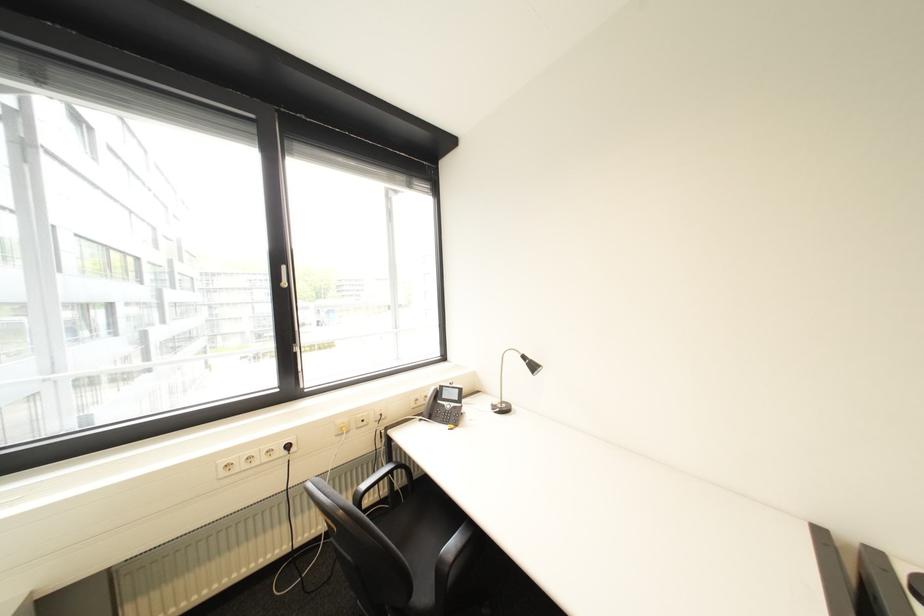
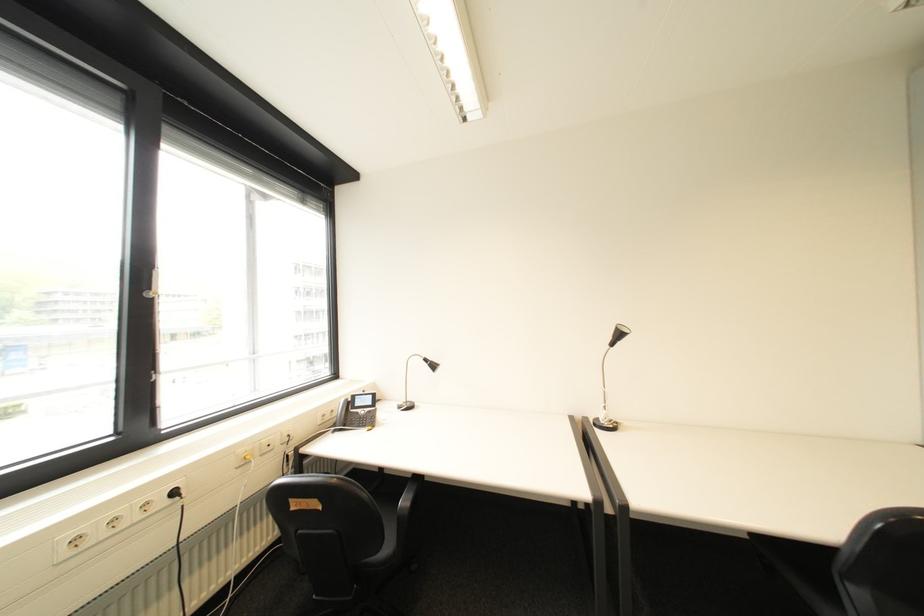
Question: How did the camera likely rotate?

Choices:
 (A) Left
 (B) Right
 (C) Up
 (D) Down

Answer: (B)